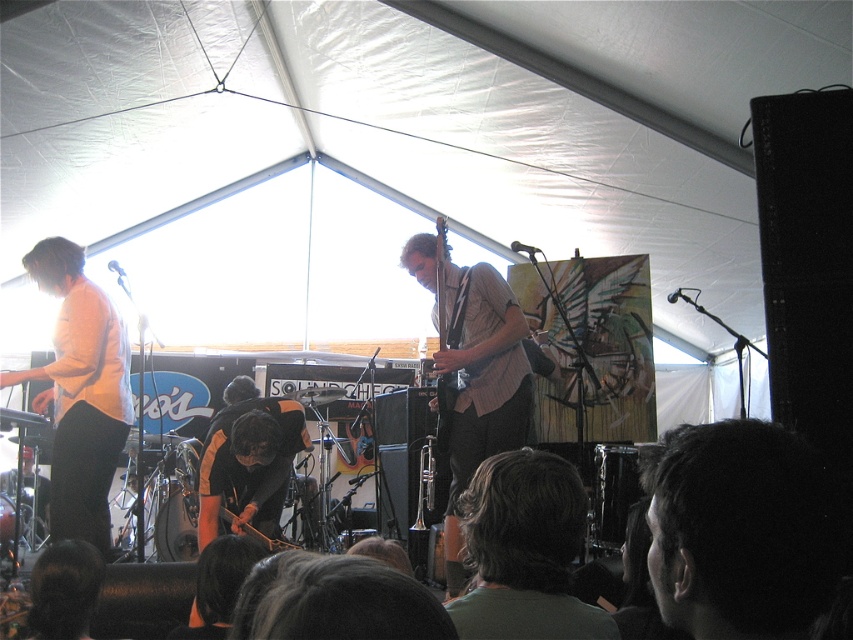
Question: Does dark brown hair at lower center appear under wooden acoustic guitar at center?

Choices:
 (A) yes
 (B) no

Answer: (A)

Question: Which point is closer to the camera?

Choices:
 (A) (456, 570)
 (B) (761, 474)

Answer: (B)

Question: Estimate the real-world distances between objects in this image. Which object is farther from the wooden acoustic guitar at center?

Choices:
 (A) dark hair at lower right
 (B) dark brown hair at lower center

Answer: (A)

Question: Does dark hair at lower right appear over light brown textured shirt at center?

Choices:
 (A) yes
 (B) no

Answer: (A)

Question: Among these objects, which one is farthest from the camera?

Choices:
 (A) wooden acoustic guitar at center
 (B) dark hair at lower right
 (C) light brown textured shirt at center
 (D) dark brown hair at lower center

Answer: (A)

Question: Considering the relative positions of dark hair at lower right and wooden acoustic guitar at center in the image provided, where is dark hair at lower right located with respect to wooden acoustic guitar at center?

Choices:
 (A) right
 (B) left

Answer: (B)